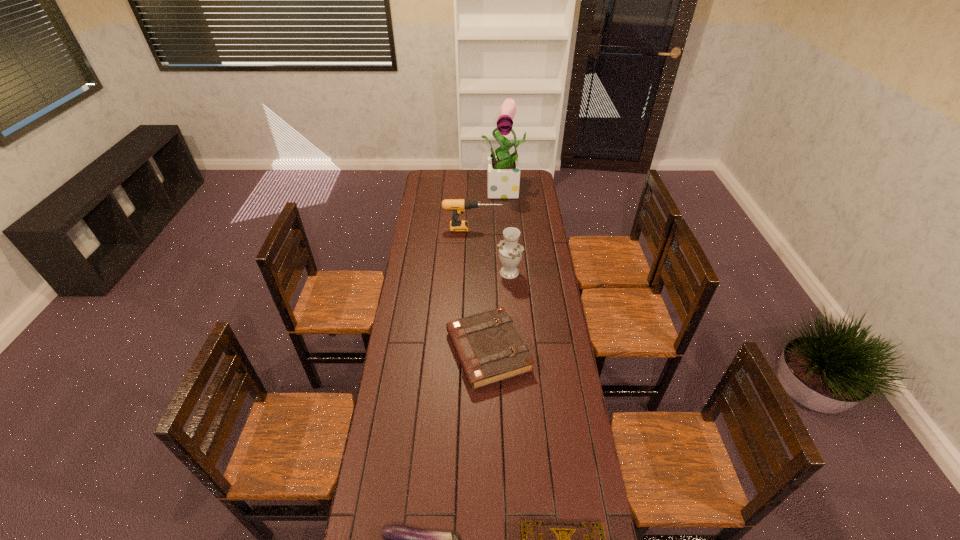
At what (x,y) coordinates should I click in order to perform the action: click on flower arrangement. Please return your answer as a coordinate pair (x, y). Image resolution: width=960 pixels, height=540 pixels. Looking at the image, I should click on (503, 174).

Identify the location of the farthest object. Image resolution: width=960 pixels, height=540 pixels. (503, 174).

Locate an element on the screen. the fourth nearest object is located at coordinates (510, 252).

This screenshot has width=960, height=540. In order to click on vase in this screenshot , I will do `click(510, 252)`.

In order to click on the fourth shortest object in this screenshot , I will do `click(457, 206)`.

At what (x,y) coordinates should I click in order to perform the action: click on drill. Please return your answer as a coordinate pair (x, y). This screenshot has height=540, width=960. Looking at the image, I should click on (457, 206).

The image size is (960, 540). Find the location of `the taller hardback book`. the taller hardback book is located at coordinates (488, 346).

Image resolution: width=960 pixels, height=540 pixels. I want to click on the fourth farthest object, so click(x=488, y=346).

I want to click on free location located 0.310m on the front-facing side of the farthest object, so click(510, 234).

Where is `free spot located 0.270m on the front of the second tallest object`? Image resolution: width=960 pixels, height=540 pixels. free spot located 0.270m on the front of the second tallest object is located at coordinates (513, 323).